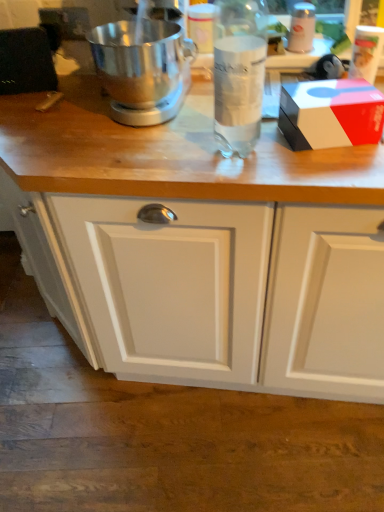
Question: Is polished silver mixer at center to the left or to the right of white glossy bottle at upper right, marked as the 2th bottle in a bottom-to-top arrangement, in the image?

Choices:
 (A) left
 (B) right

Answer: (A)

Question: Is polished silver mixer at center in front of or behind white glossy bottle at upper right, which ranks as the second bottle in left-to-right order, in the image?

Choices:
 (A) behind
 (B) front

Answer: (B)

Question: Which of these objects is positioned closest to the white matte cabinet at lower center?

Choices:
 (A) clear glass bottle at center, the second bottle positioned from the top
 (B) white glossy bottle at upper right, marked as the 2th bottle in a bottom-to-top arrangement
 (C) polished silver mixer at center

Answer: (A)

Question: Which of these objects is positioned closest to the clear glass bottle at center, which appears as the 1th bottle when viewed from the front?

Choices:
 (A) white matte cabinet at lower center
 (B) white glossy bottle at upper right, marked as the first bottle in a right-to-left arrangement
 (C) polished silver mixer at center

Answer: (C)